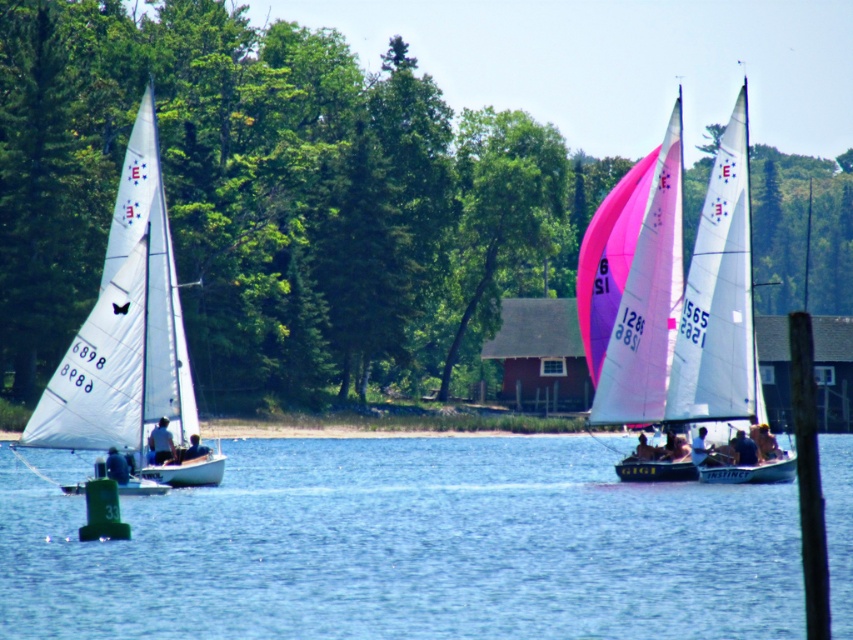
Question: Among these points, which one is nearest to the camera?

Choices:
 (A) (724, 541)
 (B) (634, 452)
 (C) (737, 440)

Answer: (A)

Question: Can you confirm if pink glossy sail at center is positioned below smooth skin face at center?

Choices:
 (A) no
 (B) yes

Answer: (A)

Question: Which point is closer to the camera?

Choices:
 (A) (155, 276)
 (B) (115, 449)
 (C) (747, 456)
 (D) (195, 436)

Answer: (B)

Question: Does pink glossy sail at center have a greater width compared to blue fabric shirt at left?

Choices:
 (A) yes
 (B) no

Answer: (A)

Question: Which object is positioned farthest from the white matte sailboat at left?

Choices:
 (A) blue fabric person at lower left
 (B) blue water at center

Answer: (B)

Question: Does pink matte sailboat at center appear under blue fabric shirt at left?

Choices:
 (A) yes
 (B) no

Answer: (B)